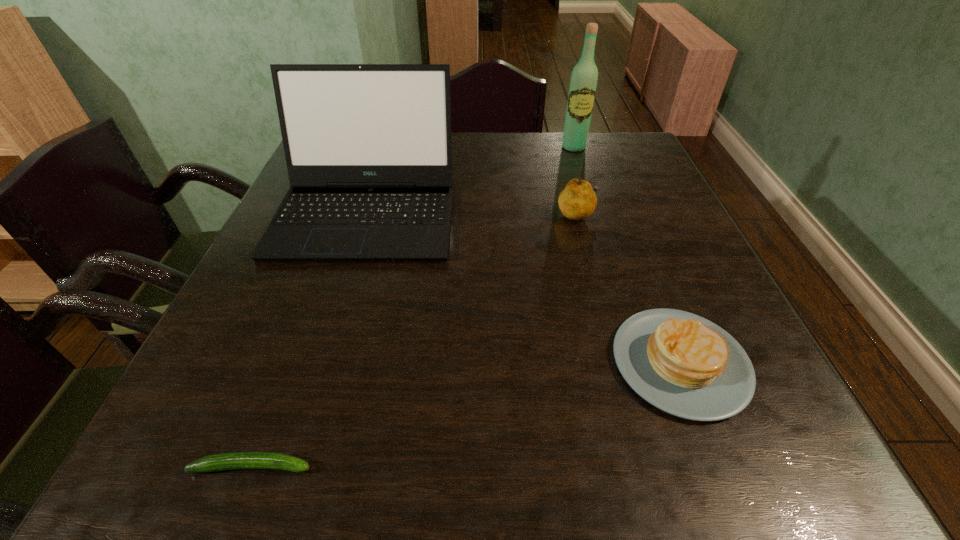
The width and height of the screenshot is (960, 540). Find the location of `free space located 0.170m on the left of the pancake`. free space located 0.170m on the left of the pancake is located at coordinates (514, 363).

You are a GUI agent. You are given a task and a screenshot of the screen. Output one action in this format:
    pyautogui.click(x=<x>, y=<y>)
    Task: Click on the free region located 0.380m on the front-facing side of the zucchini
    
    Given the screenshot: What is the action you would take?
    pyautogui.click(x=581, y=466)

Identify the location of wine bottle present at the far edge. (584, 77).

Locate an element on the screen. laptop that is positioned at the far edge is located at coordinates pyautogui.click(x=368, y=148).

Find the location of a particular element. pancake that is at the near edge is located at coordinates (683, 364).

Find the location of a particular element. zucchini present at the near edge is located at coordinates (238, 460).

Where is `laptop that is at the left edge`? laptop that is at the left edge is located at coordinates (368, 148).

Where is `zucchini located at the left edge`? zucchini located at the left edge is located at coordinates tap(238, 460).

Where is `object that is at the right edge`? object that is at the right edge is located at coordinates (683, 364).

The image size is (960, 540). I want to click on object located in the far left corner section of the desktop, so pos(368,148).